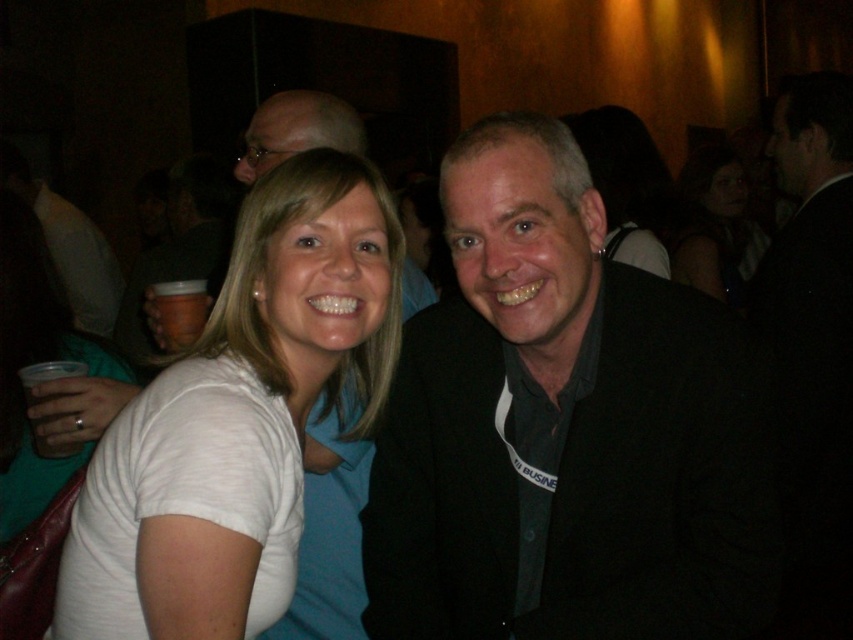
Question: Is black fabric jacket at center bigger than clear plastic cup at left?

Choices:
 (A) no
 (B) yes

Answer: (B)

Question: Which object appears closest to the camera in this image?

Choices:
 (A) black suit at right
 (B) clear plastic cup at left
 (C) smooth skin face at upper right
 (D) white cotton t-shirt at center

Answer: (D)

Question: Does black fabric jacket at center have a larger size compared to white cotton t-shirt at center?

Choices:
 (A) yes
 (B) no

Answer: (A)

Question: Which point is closer to the camera?

Choices:
 (A) brown paper cup at left
 (B) clear plastic cup at left
 (C) white cotton t-shirt at center

Answer: (C)

Question: Can you confirm if black fabric jacket at center is smaller than white cotton t-shirt at center?

Choices:
 (A) yes
 (B) no

Answer: (B)

Question: Which of the following is the farthest from the observer?

Choices:
 (A) matte black jacket at center
 (B) clear plastic cup at left

Answer: (A)